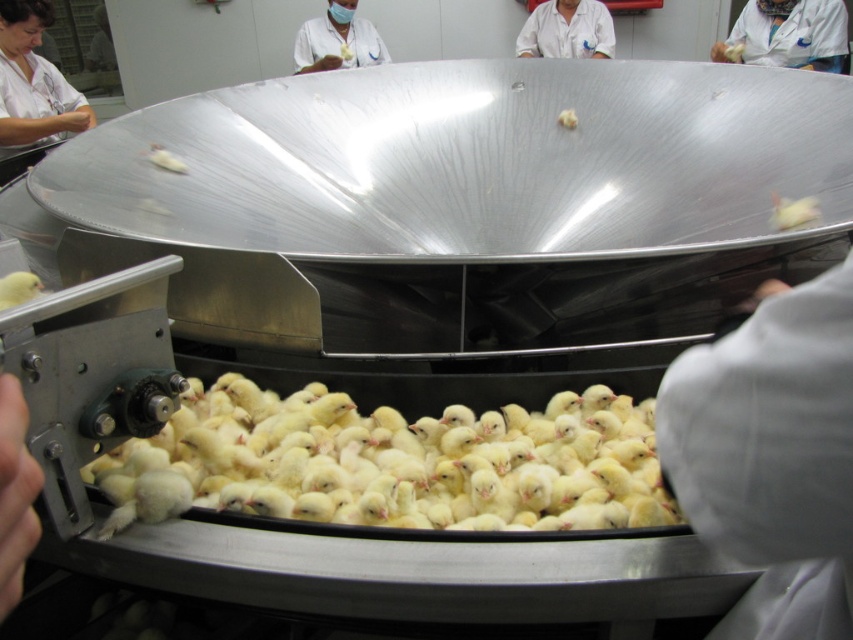
You are a new worker in the poultry farm and need to locate the matte white coat at upper center. Based on the coordinates provided in the Objects Description, can you determine its position relative to the center of the image?

The matte white coat at upper center is located at coordinates point (x=337, y=40), which places it slightly to the left and above the center of the image.

You are a poultry worker needing to place a new chick into the space between the matte white coat at upper center and the matte white chick at center. Given their sizes, will the chick fit without overlapping either object?

The matte white coat at upper center is wider than the matte white chick at center. Since the chick is smaller, there should be enough space between them to place the new chick without overlapping either object.